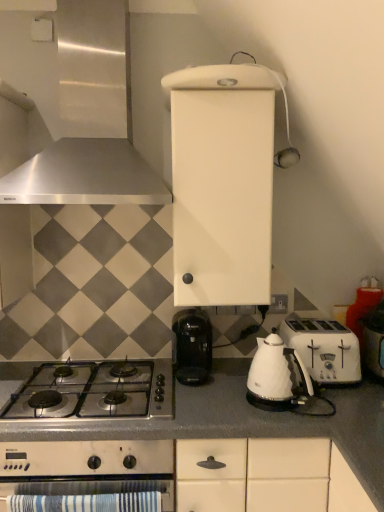
Locate an element on the screen. The height and width of the screenshot is (512, 384). vacant space in front of white glossy kettle at lower center is located at coordinates (283, 420).